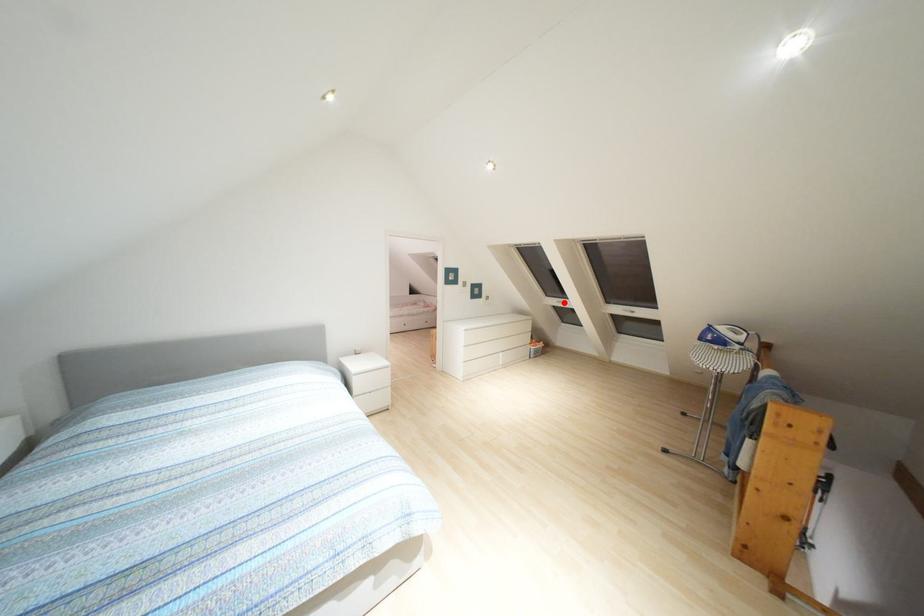
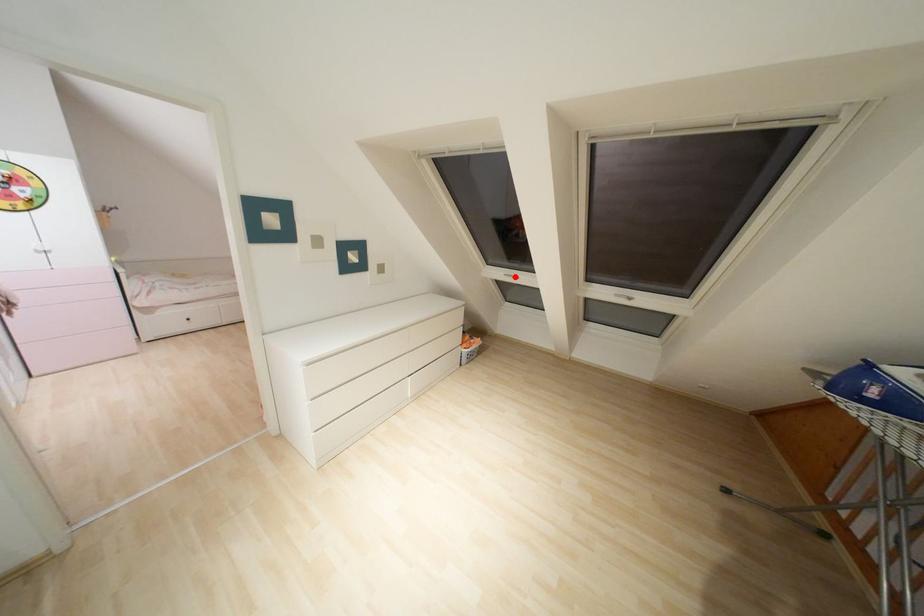
Looking at this image, I am providing you with two images of the same scene from different viewpoints. A red point is marked on the first image and another point is marked on the second image. Is the marked point in image1 the same physical position as the marked point in image2?

Yes